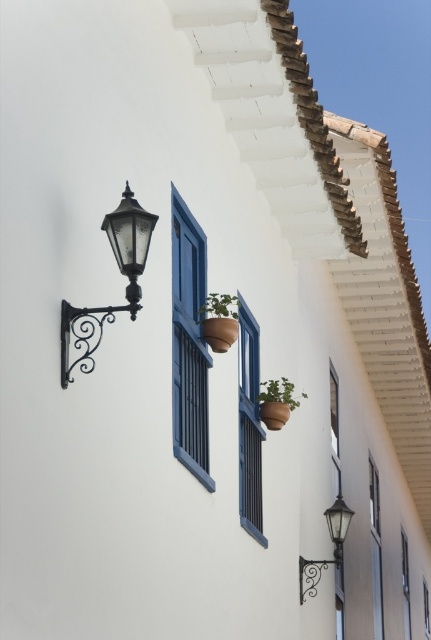
Question: Which is nearer to the blue matte window at center?

Choices:
 (A) clear glass window at right
 (B) transparent glass window at center
 (C) blue painted wood shutter at center
 (D) green matte plant at center

Answer: (D)

Question: Which of these objects is positioned closest to the blue painted wood shutter at center?

Choices:
 (A) clear glass window at right
 (B) matte black lamp at lower right

Answer: (B)

Question: Which object appears farthest from the camera in this image?

Choices:
 (A) matte black lantern at upper left
 (B) green matte plant at center
 (C) clear glass window at right

Answer: (C)

Question: Is blue matte window at center behind matte black lamp at lower right?

Choices:
 (A) yes
 (B) no

Answer: (B)

Question: Considering the relative positions of blue painted wood shutter at center and clear glass window at right in the image provided, where is blue painted wood shutter at center located with respect to clear glass window at right?

Choices:
 (A) left
 (B) right

Answer: (A)

Question: Does blue painted wood shutter at center have a larger size compared to clear glass window at right?

Choices:
 (A) no
 (B) yes

Answer: (A)